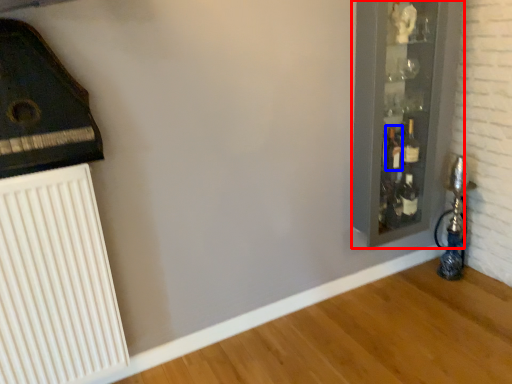
Question: Which object appears closest to the camera in this image, glass door (highlighted by a red box) or bottle (highlighted by a blue box)?

Choices:
 (A) glass door
 (B) bottle

Answer: (A)